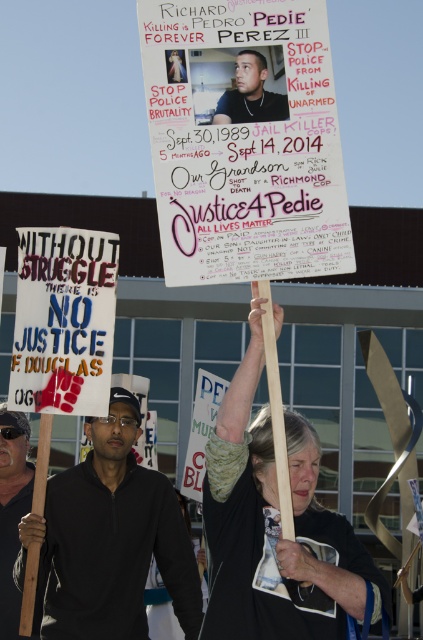
Question: Among these points, which one is nearest to the camera?

Choices:
 (A) (228, 116)
 (B) (126, 637)
 (C) (3, 589)
 (D) (274, 129)

Answer: (D)

Question: Which point appears closest to the camera in this image?

Choices:
 (A) (8, 628)
 (B) (183, 49)

Answer: (B)

Question: From the image, what is the correct spatial relationship of black fabric shirt at center in relation to black matte shirt at center?

Choices:
 (A) right
 (B) left

Answer: (A)

Question: Where is black matte shirt at center located in relation to dark brown leather jacket at lower left in the image?

Choices:
 (A) below
 (B) above

Answer: (B)

Question: Considering the real-world distances, which object is closest to the white paper poster at center?

Choices:
 (A) black fabric shirt at center
 (B) black matte shirt at center
 (C) matte black face at upper center
 (D) matte black sign at lower left

Answer: (C)

Question: Can you confirm if black fabric shirt at center is positioned to the left of black matte shirt at center?

Choices:
 (A) yes
 (B) no

Answer: (B)